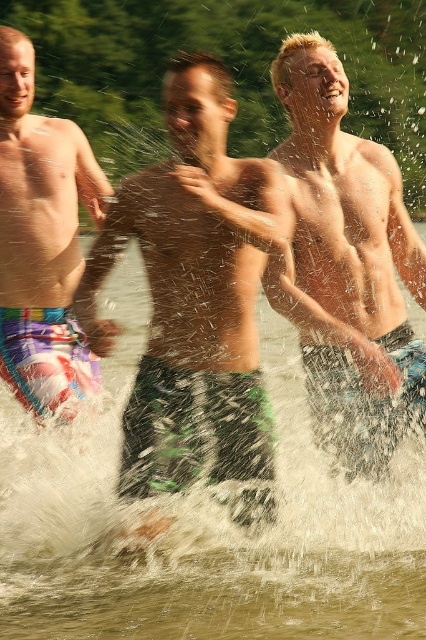
Can you confirm if green textured shorts at center is bigger than smooth skin torso at center?

Yes.

Is green textured shorts at center to the left of smooth skin torso at center from the viewer's perspective?

Indeed, green textured shorts at center is positioned on the left side of smooth skin torso at center.

Who is more forward, (189, 372) or (411, 259)?

Positioned in front is point (189, 372).

You are a GUI agent. You are given a task and a screenshot of the screen. Output one action in this format:
    pyautogui.click(x=<x>, y=<y>)
    Task: Click on the green textured shorts at center
    
    Given the screenshot: What is the action you would take?
    pyautogui.click(x=192, y=292)

Who is positioned more to the left, green textured shorts at center or multicolored swim trunks at left?

From the viewer's perspective, multicolored swim trunks at left appears more on the left side.

How distant is green textured shorts at center from multicolored swim trunks at left?

They are 5.26 feet apart.

Which is in front, point (181, 456) or point (14, 147)?

Point (181, 456)

You are a GUI agent. You are given a task and a screenshot of the screen. Output one action in this format:
    pyautogui.click(x=<x>, y=<y>)
    Task: Click on the green textured shorts at center
    This screenshot has height=640, width=426.
    Given the screenshot: What is the action you would take?
    pyautogui.click(x=192, y=292)

From the picture: Can you confirm if smooth skin torso at center is thinner than multicolored swim trunks at left?

No, smooth skin torso at center is not thinner than multicolored swim trunks at left.

Is point (396, 259) closer to viewer compared to point (69, 129)?

Yes.

Between point (351, 376) and point (63, 134), which one is positioned behind?

The point (63, 134) is more distant.

Identify the location of smooth skin torso at center. (348, 262).